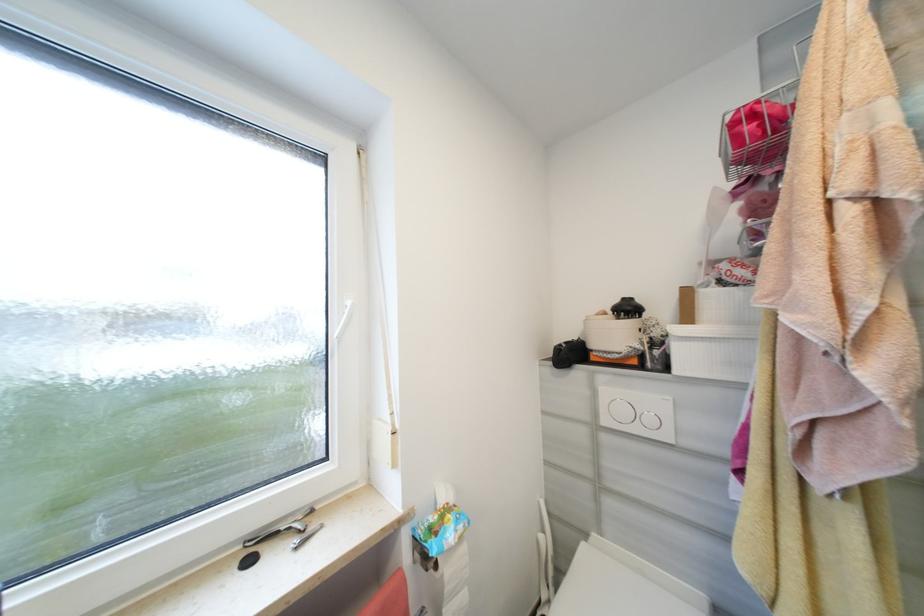
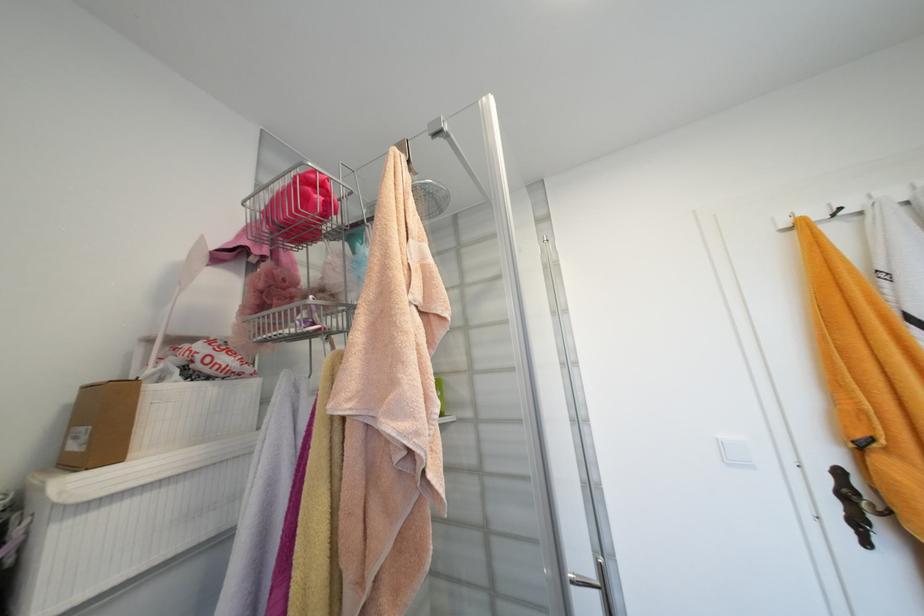
In the second image, find the point that corresponds to (739,126) in the first image.

(312, 182)